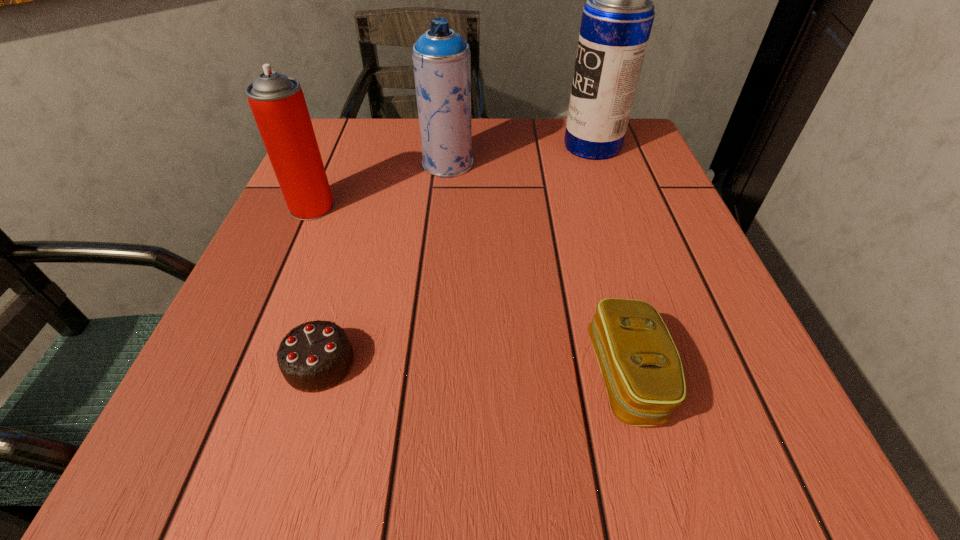
This screenshot has width=960, height=540. I want to click on aerosol can present at the right edge, so click(617, 19).

Where is `clutch bag positioned at the right edge`? The width and height of the screenshot is (960, 540). clutch bag positioned at the right edge is located at coordinates (640, 365).

This screenshot has height=540, width=960. What are the coordinates of `object present at the far right corner` in the screenshot? It's located at (617, 19).

Locate an element on the screen. object situated at the near right corner is located at coordinates (640, 365).

Identify the location of free space at the far edge. The image size is (960, 540). (549, 166).

Locate an element on the screen. The height and width of the screenshot is (540, 960). free spot at the near edge of the desktop is located at coordinates (495, 493).

Where is `free space at the left edge of the desktop`? This screenshot has width=960, height=540. free space at the left edge of the desktop is located at coordinates (259, 338).

The height and width of the screenshot is (540, 960). Find the location of `vacant space at the right edge of the desktop`. vacant space at the right edge of the desktop is located at coordinates (763, 392).

In the image, there is a desktop. At what (x,y) coordinates should I click in order to perform the action: click on free region at the near left corner. Please return your answer as a coordinate pair (x, y). Looking at the image, I should click on (238, 476).

In the image, there is a desktop. Identify the location of free space at the near right corner. The image size is (960, 540). (748, 472).